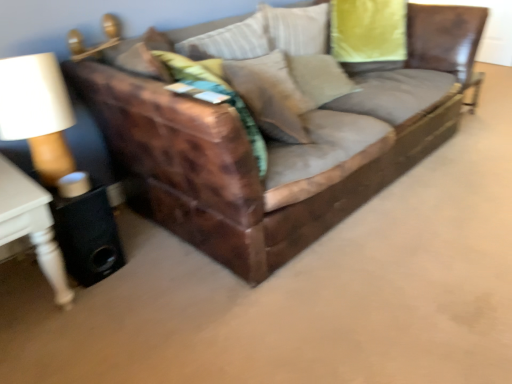
Question: Should I look upward or downward to see white wood side table at left?

Choices:
 (A) down
 (B) up

Answer: (A)

Question: From the image's perspective, does white wood side table at left appear higher than leather couch at center?

Choices:
 (A) yes
 (B) no

Answer: (B)

Question: Is white wood side table at left at the left side of leather couch at center?

Choices:
 (A) yes
 (B) no

Answer: (A)

Question: Can you confirm if white wood side table at left is bigger than leather couch at center?

Choices:
 (A) yes
 (B) no

Answer: (B)

Question: Are white wood side table at left and leather couch at center far apart?

Choices:
 (A) no
 (B) yes

Answer: (A)

Question: From a real-world perspective, is white wood side table at left under leather couch at center?

Choices:
 (A) yes
 (B) no

Answer: (A)

Question: Does white wood side table at left lie behind leather couch at center?

Choices:
 (A) yes
 (B) no

Answer: (A)

Question: From the image's perspective, is suede-like beige pillow at center under white wood side table at left?

Choices:
 (A) yes
 (B) no

Answer: (B)

Question: Is suede-like beige pillow at center further to camera compared to white wood side table at left?

Choices:
 (A) yes
 (B) no

Answer: (A)

Question: Is suede-like beige pillow at center in contact with white wood side table at left?

Choices:
 (A) yes
 (B) no

Answer: (B)

Question: From a real-world perspective, does suede-like beige pillow at center stand above white wood side table at left?

Choices:
 (A) yes
 (B) no

Answer: (A)

Question: Can you confirm if suede-like beige pillow at center is positioned to the right of white wood side table at left?

Choices:
 (A) no
 (B) yes

Answer: (B)

Question: Does suede-like beige pillow at center have a smaller size compared to white wood side table at left?

Choices:
 (A) yes
 (B) no

Answer: (A)

Question: From the image's perspective, is suede-like beige pillow at center over leather couch at center?

Choices:
 (A) no
 (B) yes

Answer: (A)